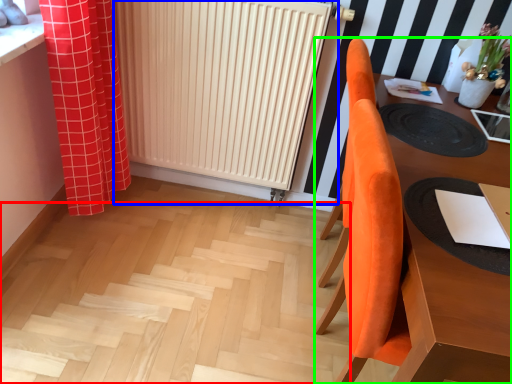
Question: Which object is positioned farthest from stairs (highlighted by a red box)? Select from radiator (highlighted by a blue box) and furniture (highlighted by a green box).

Choices:
 (A) radiator
 (B) furniture

Answer: (B)